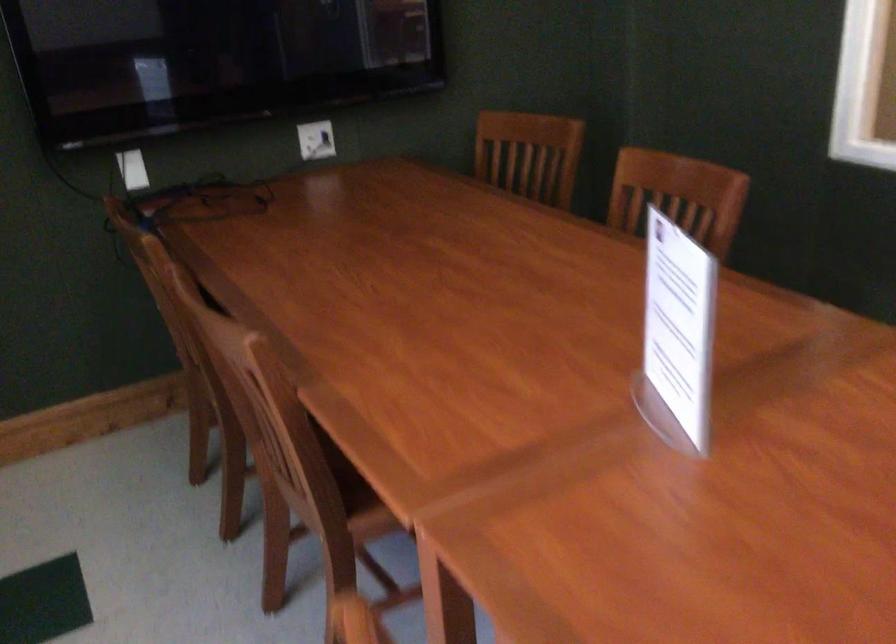
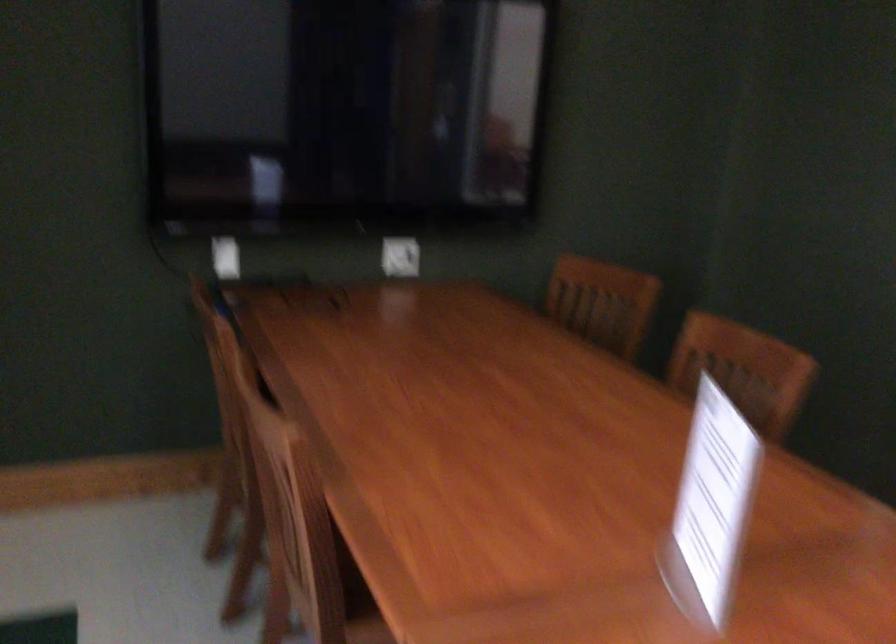
What movement of the cameraman would produce the second image?

The cameraman moved toward right, backward.